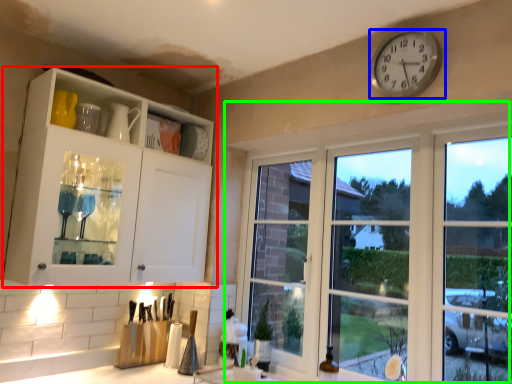
Question: Which object is the farthest from cabinetry (highlighted by a red box)? Choose among these: wall clock (highlighted by a blue box) or window (highlighted by a green box).

Choices:
 (A) wall clock
 (B) window

Answer: (A)